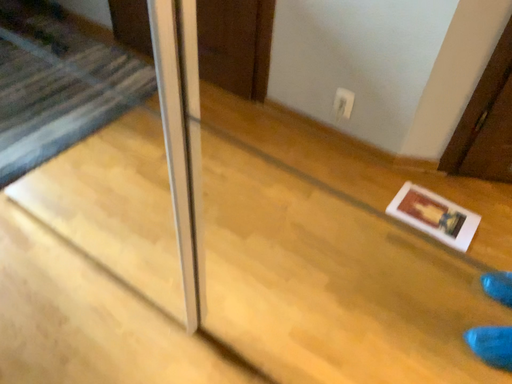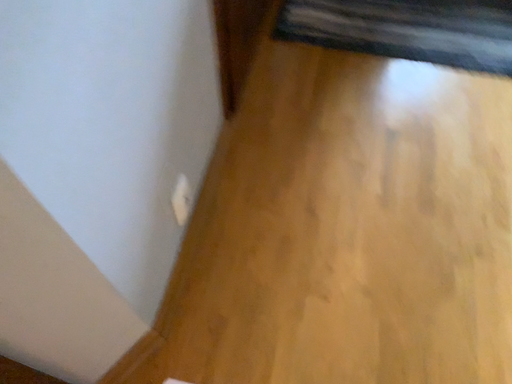
Question: How did the camera likely rotate when shooting the video?

Choices:
 (A) rotated left
 (B) rotated right

Answer: (A)